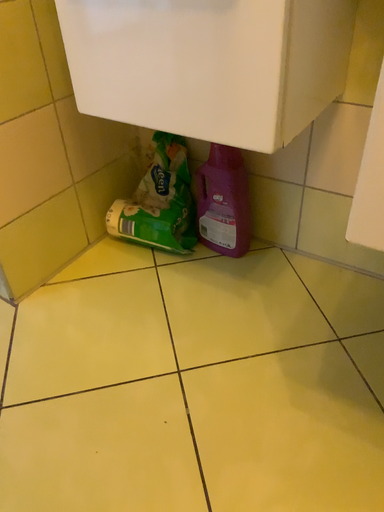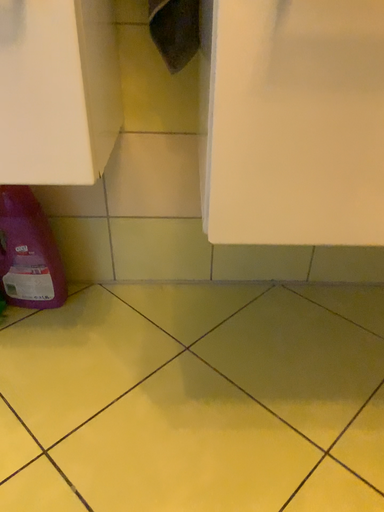
Question: How did the camera likely rotate when shooting the video?

Choices:
 (A) rotated right
 (B) rotated left

Answer: (A)